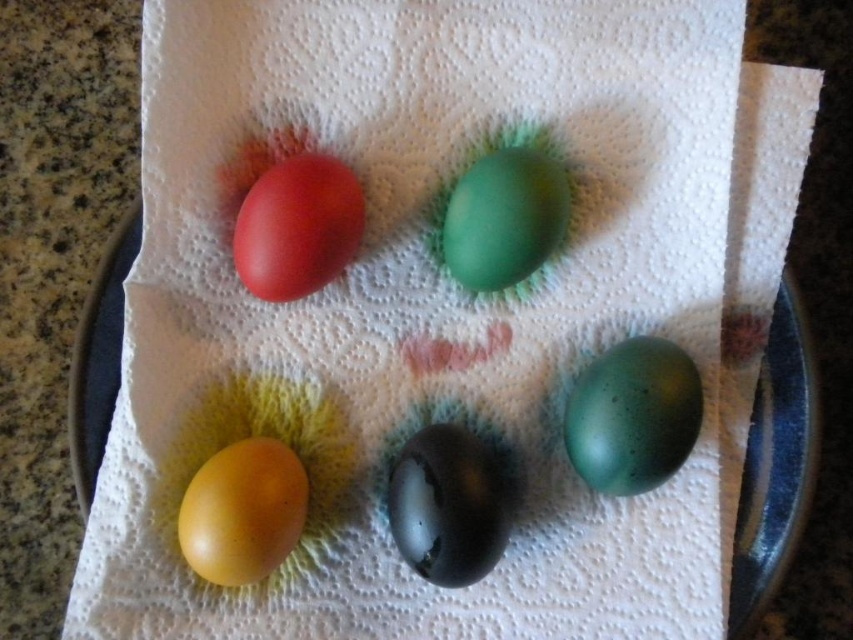
Question: Estimate the real-world distances between objects in this image. Which object is farther from the matte red egg at upper left?

Choices:
 (A) yellow matte egg at lower left
 (B) green matte egg at center

Answer: (A)

Question: Can you confirm if speckled green egg at lower right is thinner than matte red egg at upper left?

Choices:
 (A) no
 (B) yes

Answer: (B)

Question: Which point is farther from the camera taking this photo?

Choices:
 (A) (582, 417)
 (B) (517, 228)
 (C) (235, 509)
 (D) (349, 212)

Answer: (D)

Question: Is speckled green egg at lower right to the right of green matte egg at center from the viewer's perspective?

Choices:
 (A) yes
 (B) no

Answer: (A)

Question: Is matte red egg at upper left wider than yellow matte egg at lower left?

Choices:
 (A) yes
 (B) no

Answer: (A)

Question: Which point is farther to the camera?

Choices:
 (A) (314, 168)
 (B) (248, 499)

Answer: (A)